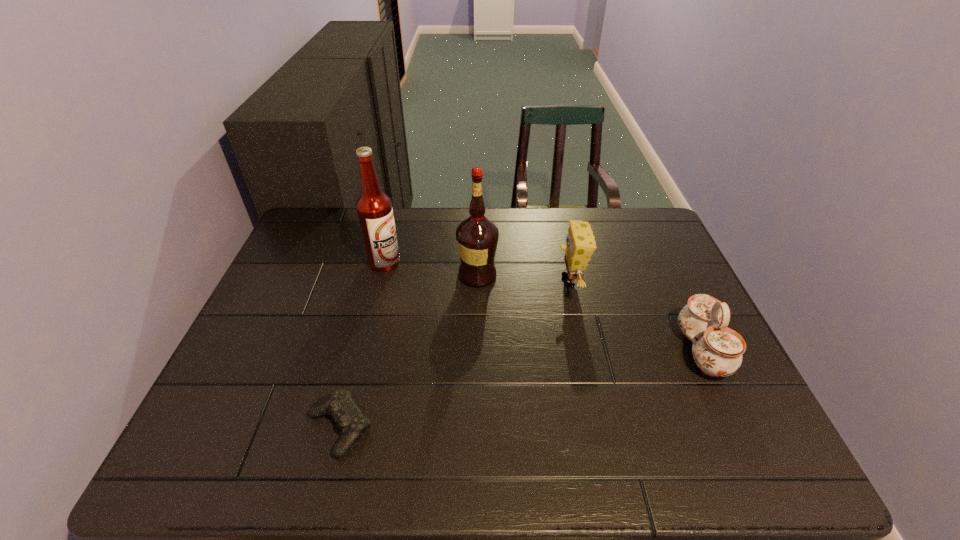
Image resolution: width=960 pixels, height=540 pixels. Find the location of `vacant space situated on the face of the second object from right to left`. vacant space situated on the face of the second object from right to left is located at coordinates (499, 281).

The image size is (960, 540). Identify the location of free space located 0.170m on the face of the second object from right to left. (496, 281).

Locate an element on the screen. vacant space located by the handle of the chinaware is located at coordinates (636, 351).

The width and height of the screenshot is (960, 540). In order to click on vacant space situated 0.380m by the handle of the chinaware in this screenshot , I will do `click(526, 351)`.

Locate an element on the screen. The width and height of the screenshot is (960, 540). free space located 0.170m by the handle of the chinaware is located at coordinates (612, 351).

Find the location of `free region located on the back of the shortest object`. free region located on the back of the shortest object is located at coordinates (377, 281).

This screenshot has width=960, height=540. In order to click on object at the near edge in this screenshot , I will do `click(339, 404)`.

I want to click on object located in the right edge section of the desktop, so click(x=717, y=350).

Identify the location of free space at the far edge of the desktop. This screenshot has width=960, height=540. (497, 207).

Where is `vacant region at the near edge`? The height and width of the screenshot is (540, 960). vacant region at the near edge is located at coordinates (464, 448).